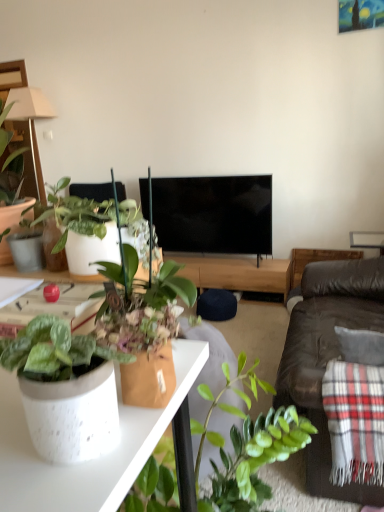
Question: From a real-world perspective, is white speckled pot at left, which is counted as the second houseplant, starting from the right, beneath black glossy tv at center?

Choices:
 (A) no
 (B) yes

Answer: (A)

Question: Are white speckled pot at left, arranged as the 1th houseplant when viewed from the left, and black glossy tv at center located far from each other?

Choices:
 (A) yes
 (B) no

Answer: (A)

Question: From a real-world perspective, is white speckled pot at left, acting as the first houseplant starting from the top, located higher than black glossy tv at center?

Choices:
 (A) yes
 (B) no

Answer: (A)

Question: Is white speckled pot at left, the second houseplant positioned from the bottom, facing away from black glossy tv at center?

Choices:
 (A) no
 (B) yes

Answer: (A)

Question: Is white speckled pot at left, acting as the first houseplant starting from the top, located outside black glossy tv at center?

Choices:
 (A) no
 (B) yes

Answer: (B)

Question: Can you confirm if white speckled pot at left, acting as the first houseplant starting from the top, is taller than black glossy tv at center?

Choices:
 (A) no
 (B) yes

Answer: (A)

Question: From a real-world perspective, does beige fabric lamp at upper left stand above brown leather couch at right?

Choices:
 (A) yes
 (B) no

Answer: (A)

Question: Is beige fabric lamp at upper left completely or partially outside of brown leather couch at right?

Choices:
 (A) no
 (B) yes

Answer: (B)

Question: Is the position of beige fabric lamp at upper left less distant than that of brown leather couch at right?

Choices:
 (A) yes
 (B) no

Answer: (A)

Question: Is beige fabric lamp at upper left shorter than brown leather couch at right?

Choices:
 (A) yes
 (B) no

Answer: (A)

Question: Can you confirm if beige fabric lamp at upper left is taller than brown leather couch at right?

Choices:
 (A) yes
 (B) no

Answer: (B)

Question: Is beige fabric lamp at upper left at the left side of brown leather couch at right?

Choices:
 (A) yes
 (B) no

Answer: (A)

Question: Is black glossy tv at center to the right of white speckled pot at left, which is counted as the second houseplant, starting from the right, from the viewer's perspective?

Choices:
 (A) yes
 (B) no

Answer: (A)